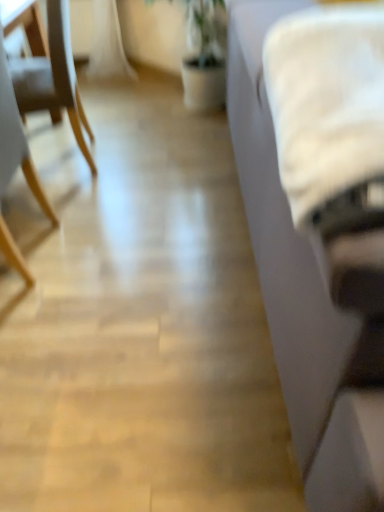
Question: Is wooden chair at left, placed as the second chair when sorted from back to front, at the right side of white fabric couch at right?

Choices:
 (A) yes
 (B) no

Answer: (B)

Question: Is wooden chair at left, placed as the second chair when sorted from back to front, positioned beyond the bounds of white fabric couch at right?

Choices:
 (A) no
 (B) yes

Answer: (B)

Question: Is wooden chair at left, which appears as the 1th chair when viewed from the front, positioned in front of white fabric couch at right?

Choices:
 (A) no
 (B) yes

Answer: (A)

Question: From the image's perspective, would you say wooden chair at left, which appears as the 1th chair when viewed from the front, is shown under white fabric couch at right?

Choices:
 (A) yes
 (B) no

Answer: (A)

Question: Can you confirm if wooden chair at left, which appears as the 1th chair when viewed from the front, is positioned to the left of white fabric couch at right?

Choices:
 (A) no
 (B) yes

Answer: (B)

Question: Is wooden chair at left, placed as the second chair when sorted from back to front, touching white fabric couch at right?

Choices:
 (A) no
 (B) yes

Answer: (A)

Question: Considering the relative sizes of white fabric couch at right and light wood chair at left, which appears as the 1th chair when viewed from the back, in the image provided, is white fabric couch at right taller than light wood chair at left, which appears as the 1th chair when viewed from the back,?

Choices:
 (A) yes
 (B) no

Answer: (A)

Question: Is white fabric couch at right directly adjacent to light wood chair at left, which appears as the 1th chair when viewed from the back?

Choices:
 (A) no
 (B) yes

Answer: (A)

Question: Is the position of white fabric couch at right less distant than that of light wood chair at left, which appears as the 1th chair when viewed from the back?

Choices:
 (A) yes
 (B) no

Answer: (A)

Question: Is white fabric couch at right positioned with its back to light wood chair at left, which appears as the 1th chair when viewed from the back?

Choices:
 (A) no
 (B) yes

Answer: (B)

Question: Could you tell me if white fabric couch at right is facing light wood chair at left, which is the second chair from front to back?

Choices:
 (A) yes
 (B) no

Answer: (B)

Question: Is white fabric couch at right at the right side of light wood chair at left, which appears as the 1th chair when viewed from the back?

Choices:
 (A) yes
 (B) no

Answer: (A)

Question: From the image's perspective, is light wood chair at left, which is the second chair from front to back, on white fabric couch at right?

Choices:
 (A) no
 (B) yes

Answer: (B)